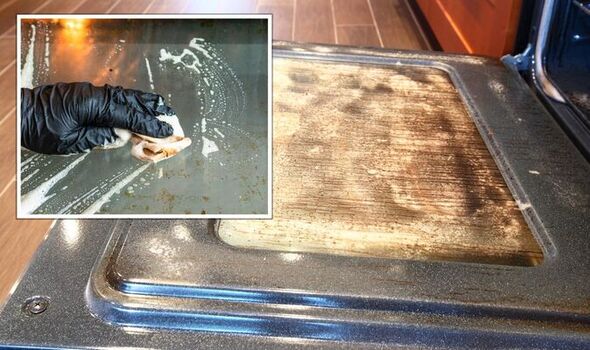
Find the location of `oven rack`. oven rack is located at coordinates (582, 6).